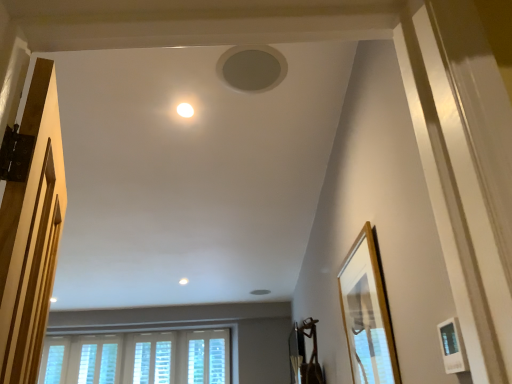
Question: Does point (218, 339) appear closer or farther from the camera than point (459, 339)?

Choices:
 (A) farther
 (B) closer

Answer: (A)

Question: From a real-world perspective, relative to white matte picture frame at lower right, which ranks as the 1th picture frame in front-to-back order, is white textured window at lower center, arranged as the 1th window when viewed from the right, vertically above or below?

Choices:
 (A) above
 (B) below

Answer: (A)

Question: Which object is the farthest from the white matte picture frame at lower right, which ranks as the 1th picture frame in front-to-back order?

Choices:
 (A) white glossy light fixture at upper center
 (B) matte gray speaker at upper center, which ranks as the 2th hole in bottom-to-top order
 (C) white textured blinds at lower center, the third window from the left
 (D) wooden picture frame at right, which is counted as the 1th picture frame, starting from the back
 (E) white matte hole at upper center, the first hole viewed from the back

Answer: (C)

Question: Estimate the real-world distances between objects in this image. Which object is closer to the matte gray speaker at upper center, acting as the second hole starting from the back?

Choices:
 (A) white matte hole at upper center, which is counted as the 2th hole, starting from the top
 (B) white textured blinds at lower center, the third window from the left
 (C) white matte picture frame at lower right, arranged as the 2th picture frame when viewed from the back
 (D) wooden picture frame at right, which is counted as the 1th picture frame, starting from the back
 (E) white glossy light fixture at upper center

Answer: (E)